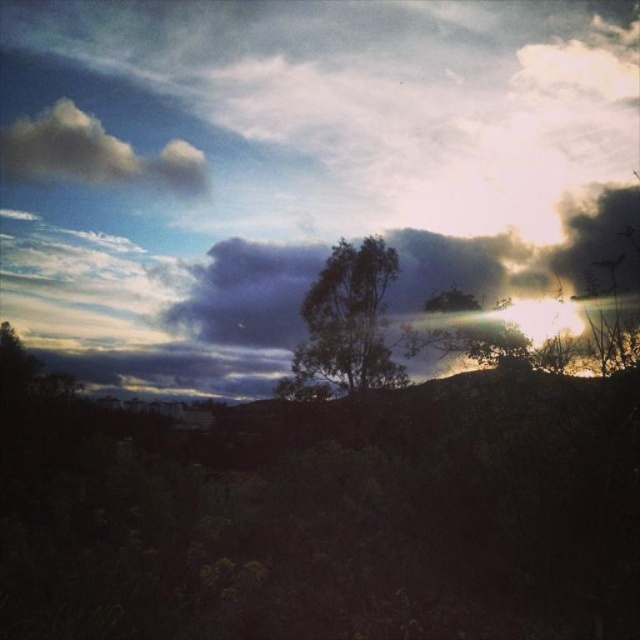
Between point (353, 292) and point (52, 108), which one is positioned behind?

Positioned behind is point (52, 108).

Between green leafy tree at center and white fluffy cloud at upper left, which one has less height?

green leafy tree at center

Between point (362, 307) and point (61, 118), which one is positioned in front?

Point (362, 307)

Image resolution: width=640 pixels, height=640 pixels. What are the coordinates of `green leafy tree at center` in the screenshot? It's located at (346, 323).

Which is more to the left, dark gray cloud at upper center or green leafy tree at center?

dark gray cloud at upper center

Which is below, dark gray cloud at upper center or green leafy tree at center?

green leafy tree at center is lower down.

Is point (452, 276) behind point (289, 396)?

That is True.

At what (x,y) coordinates should I click in order to perform the action: click on dark gray cloud at upper center. Please return your answer as a coordinate pair (x, y). This screenshot has width=640, height=640. Looking at the image, I should click on (250, 292).

Measure the distance between dark gray cloud at upper center and camera.

90.03 feet

Does dark gray cloud at upper center have a lesser width compared to white fluffy cloud at upper left?

In fact, dark gray cloud at upper center might be wider than white fluffy cloud at upper left.

What do you see at coordinates (250, 292) in the screenshot?
I see `dark gray cloud at upper center` at bounding box center [250, 292].

At what (x,y) coordinates should I click in order to perform the action: click on dark gray cloud at upper center. Please return your answer as a coordinate pair (x, y). This screenshot has height=640, width=640. Looking at the image, I should click on (250, 292).